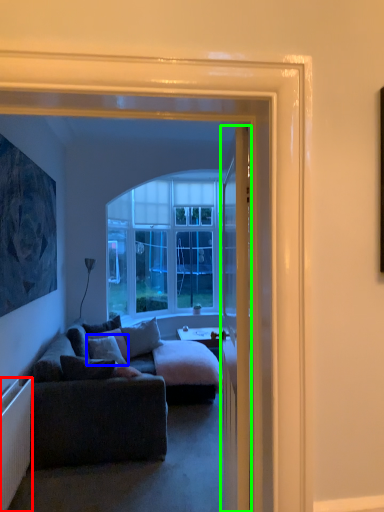
Question: Estimate the real-world distances between objects in this image. Which object is closer to radiator (highlighted by a red box), pillow (highlighted by a blue box) or door (highlighted by a green box)?

Choices:
 (A) pillow
 (B) door

Answer: (B)